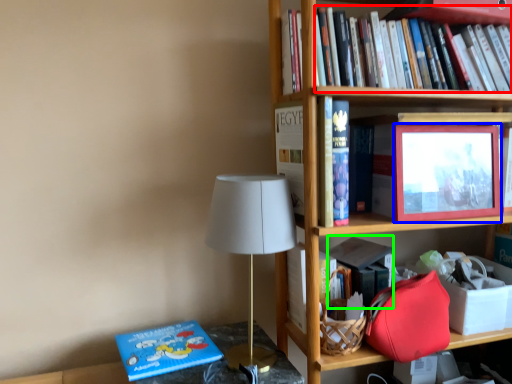
Question: Which is nearer to the book (highlighted by a red box)? picture frame (highlighted by a blue box) or paperback book (highlighted by a green box).

Choices:
 (A) picture frame
 (B) paperback book

Answer: (A)